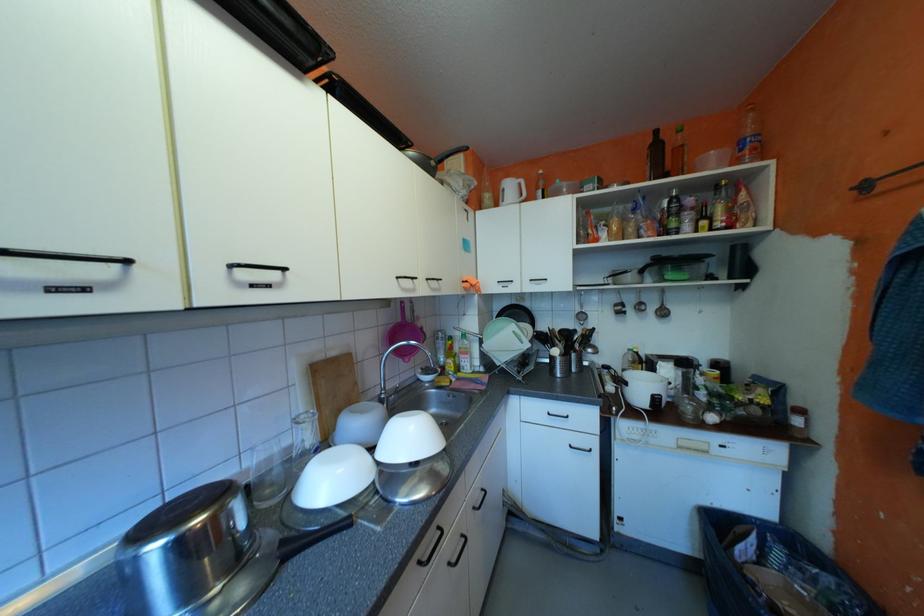
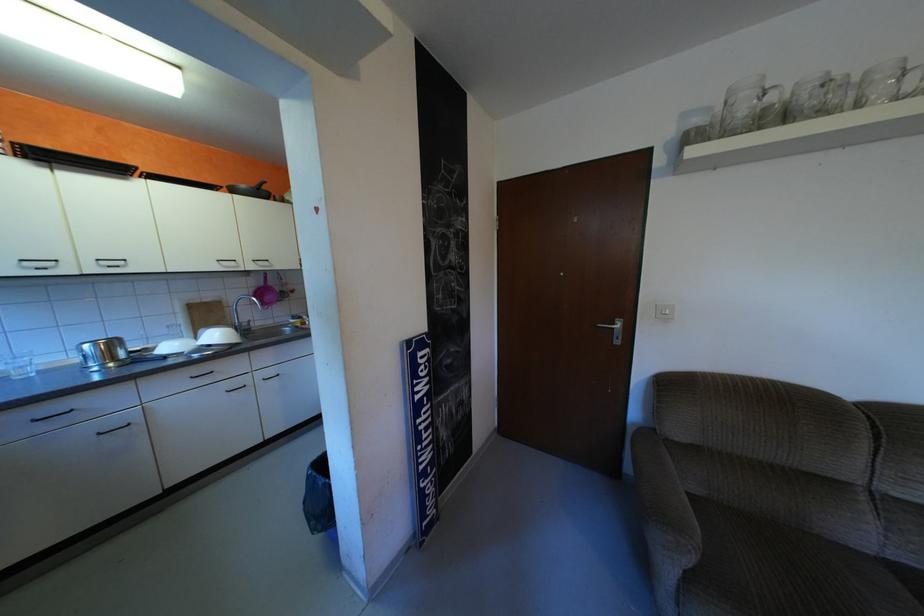
Question: What movement of the cameraman would produce the second image?

Choices:
 (A) Left
 (B) Right
 (C) Forward
 (D) Backward

Answer: (B)